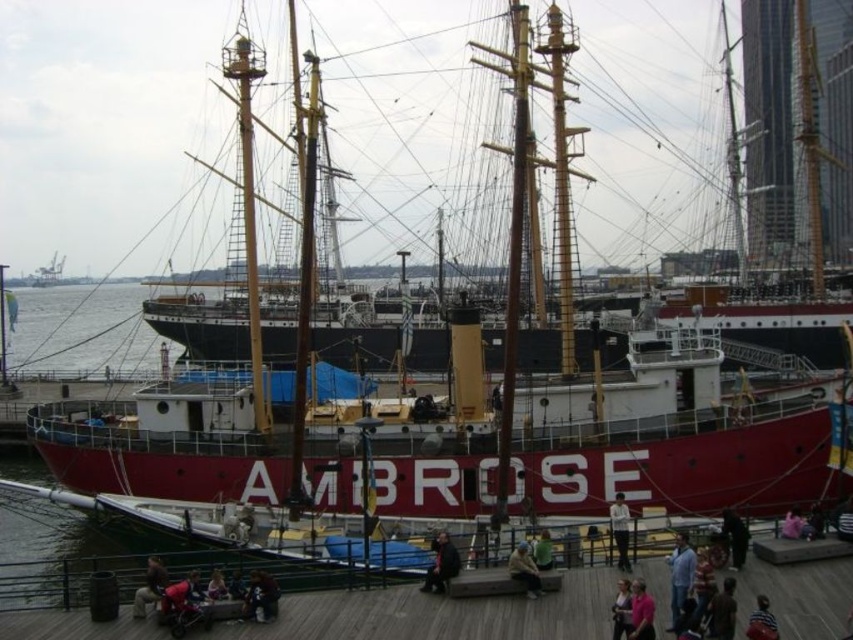
Question: Can you confirm if dark brown leather jacket at center is positioned below dark gray sweater at lower center?

Choices:
 (A) yes
 (B) no

Answer: (B)

Question: Can you confirm if dark blue jeans at lower center is thinner than white matte shirt at center?

Choices:
 (A) no
 (B) yes

Answer: (B)

Question: Which object is the closest to the green fabric bag at lower center?

Choices:
 (A) dark gray fabric jacket at lower right
 (B) striped shirt at lower right

Answer: (A)

Question: Where is red shirt at lower left located in relation to light brown leather jacket at lower left in the image?

Choices:
 (A) left
 (B) right

Answer: (B)

Question: Estimate the real-world distances between objects in this image. Which object is closer to the dark blue jeans at lower right?

Choices:
 (A) pink fabric shirt at lower center
 (B) green fabric bag at lower center

Answer: (A)

Question: Among these objects, which one is nearest to the camera?

Choices:
 (A) dark brown leather jacket at center
 (B) light brown leather jacket at lower center
 (C) clear water at left

Answer: (B)